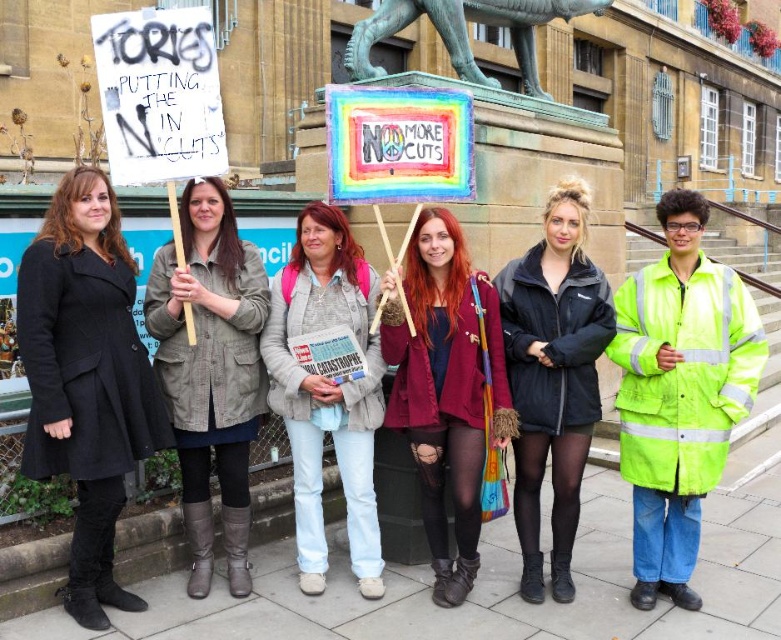
Question: Estimate the real-world distances between objects in this image. Which object is closer to the matte black coat at left?

Choices:
 (A) bronze statue at upper center
 (B) denim jacket at center
 (C) maroon satin blazer at center

Answer: (B)

Question: Which of the following is the farthest from the observer?

Choices:
 (A) (179, 392)
 (B) (576, 490)

Answer: (B)

Question: Can you confirm if matte gray jacket at center is thinner than maroon satin blazer at center?

Choices:
 (A) yes
 (B) no

Answer: (A)

Question: Estimate the real-world distances between objects in this image. Which object is farther from the maroon satin blazer at center?

Choices:
 (A) matte gray jacket at center
 (B) black matte jacket at center

Answer: (A)

Question: Is matte black coat at left positioned at the back of bronze statue at upper center?

Choices:
 (A) yes
 (B) no

Answer: (B)

Question: Is matte black coat at left thinner than denim jacket at center?

Choices:
 (A) yes
 (B) no

Answer: (B)